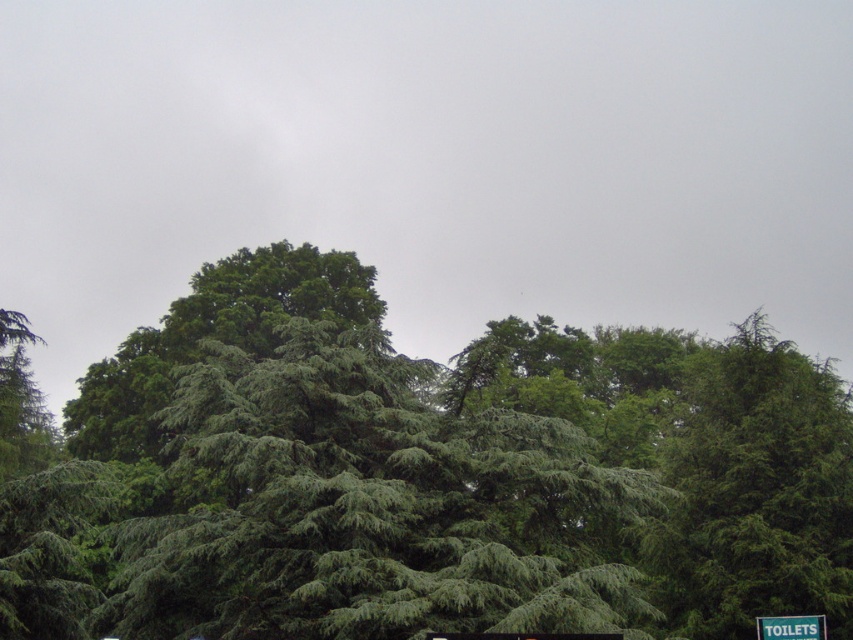
Question: Where is green needle-like at center located in relation to green plastic sign at upper right in the image?

Choices:
 (A) right
 (B) left

Answer: (B)

Question: Which point is farther to the camera?

Choices:
 (A) (86, 403)
 (B) (824, 636)

Answer: (A)

Question: Is green needle-like at center bigger than green plastic sign at upper right?

Choices:
 (A) yes
 (B) no

Answer: (A)

Question: Which point is closer to the camera?

Choices:
 (A) (431, 598)
 (B) (463, 634)

Answer: (B)

Question: Does green needle-like at center have a larger size compared to green plastic sign at upper right?

Choices:
 (A) yes
 (B) no

Answer: (A)

Question: Among these points, which one is farthest from the camera?

Choices:
 (A) (523, 634)
 (B) (810, 625)
 (C) (618, 433)

Answer: (C)